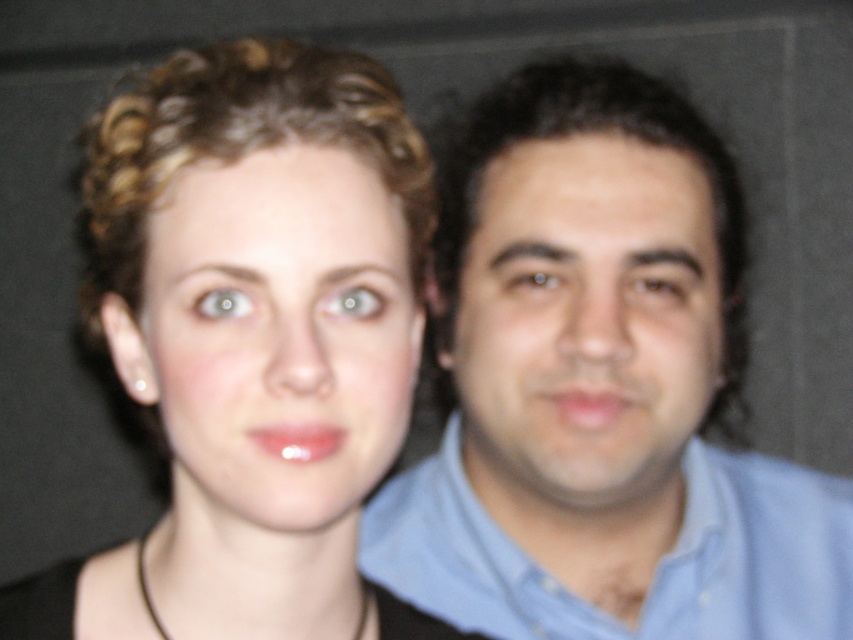
Who is more forward, [502,292] or [670,291]?

Point [502,292]

Is smooth skin face at right further to camera compared to brown matte eye at center?

No, it is not.

Which is behind, point (595, 192) or point (654, 266)?

The point (654, 266) is more distant.

Locate an element on the screen. smooth skin face at right is located at coordinates (584, 323).

Does point (380, 88) come in front of point (270, 353)?

No, (380, 88) is further to viewer.

Is point (74, 621) behind point (190, 168)?

Yes, it is.

What do you see at coordinates (251, 340) in the screenshot? I see `matte black hair at center` at bounding box center [251, 340].

At what (x,y) coordinates should I click in order to perform the action: click on matte black hair at center. Please return your answer as a coordinate pair (x, y). The image size is (853, 640). Looking at the image, I should click on (251, 340).

Describe the element at coordinates (599, 388) in the screenshot. I see `blue shirt at right` at that location.

Is blue shirt at right taller than blue cotton shirt at right?

Indeed, blue shirt at right has a greater height compared to blue cotton shirt at right.

You are a GUI agent. You are given a task and a screenshot of the screen. Output one action in this format:
    pyautogui.click(x=<x>, y=<y>)
    Task: Click on the blue shirt at right
    This screenshot has width=853, height=640.
    Given the screenshot: What is the action you would take?
    pyautogui.click(x=599, y=388)

Locate an element on the screen. This screenshot has height=640, width=853. blue shirt at right is located at coordinates (599, 388).